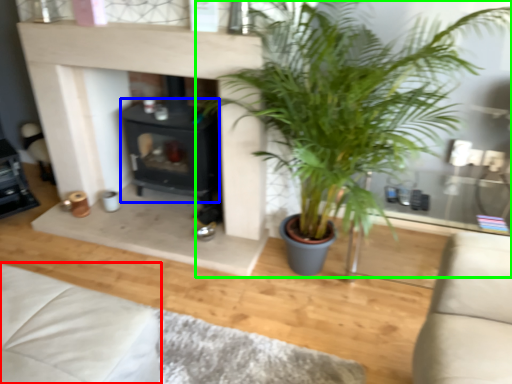
Question: Which object is positioned closest to couch (highlighted by a red box)? Select from fireplace (highlighted by a blue box) and houseplant (highlighted by a green box).

Choices:
 (A) fireplace
 (B) houseplant

Answer: (B)